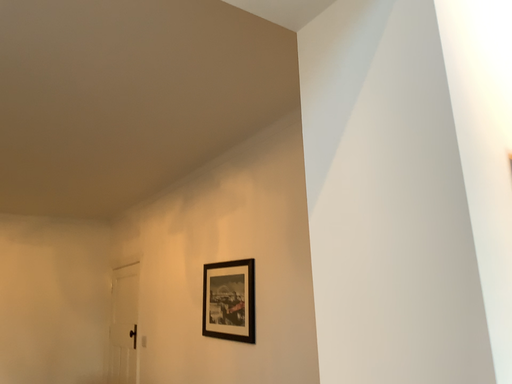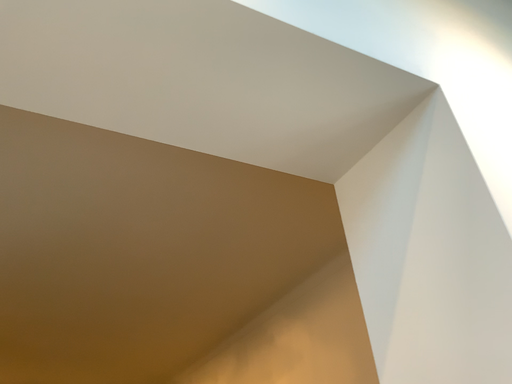
Question: Which way did the camera rotate in the video?

Choices:
 (A) rotated right
 (B) rotated left

Answer: (B)